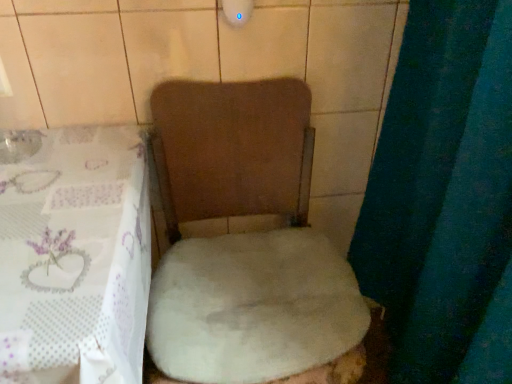
Question: From their relative heights in the image, would you say white sheer tablecloth at lower left is taller or shorter than white fluffy toilet at center?

Choices:
 (A) short
 (B) tall

Answer: (A)

Question: From the image's perspective, is white sheer tablecloth at lower left above or below white fluffy toilet at center?

Choices:
 (A) above
 (B) below

Answer: (B)

Question: Estimate the real-world distances between objects in this image. Which object is farther from the white fluffy toilet at center?

Choices:
 (A) white sheer tablecloth at lower left
 (B) white fluffy rug at center

Answer: (A)

Question: Based on their relative distances, which object is nearer to the white fluffy rug at center?

Choices:
 (A) white sheer tablecloth at lower left
 (B) white fluffy toilet at center

Answer: (B)